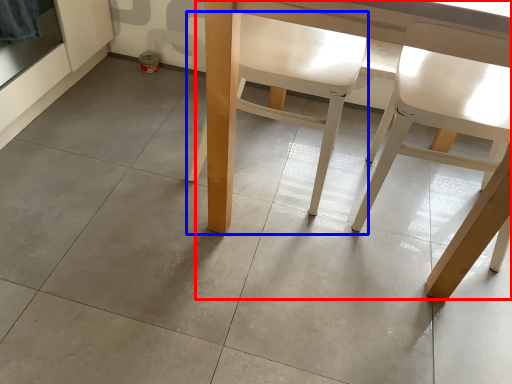
Question: Which of the following is the farthest to the observer, table (highlighted by a red box) or chair (highlighted by a blue box)?

Choices:
 (A) table
 (B) chair

Answer: (B)